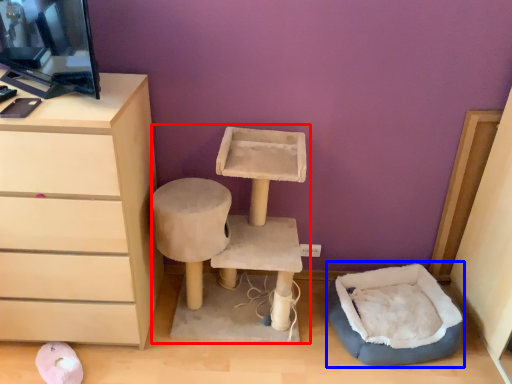
Question: Which point is closer to the camera, vanity (highlighted by a red box) or bean bag chair (highlighted by a blue box)?

Choices:
 (A) vanity
 (B) bean bag chair

Answer: (A)